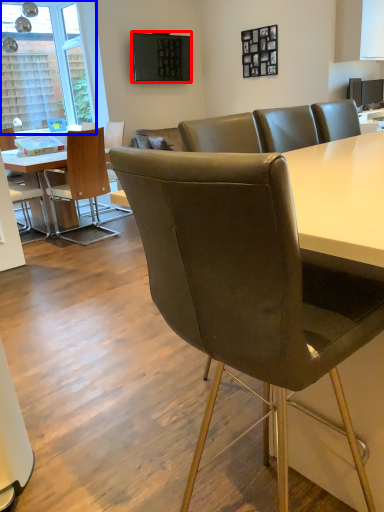
Question: Which object is further to the camera taking this photo, television (highlighted by a red box) or window (highlighted by a blue box)?

Choices:
 (A) television
 (B) window

Answer: (B)